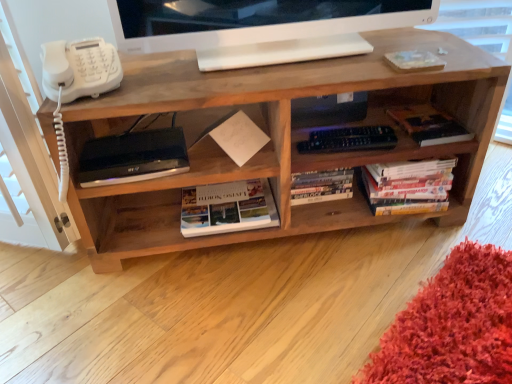
Question: Are satin black device at lower left and white plastic phone at left far apart?

Choices:
 (A) no
 (B) yes

Answer: (A)

Question: From a real-world perspective, does satin black device at lower left sit lower than white plastic phone at left?

Choices:
 (A) yes
 (B) no

Answer: (A)

Question: Is satin black device at lower left positioned in front of white plastic phone at left?

Choices:
 (A) no
 (B) yes

Answer: (A)

Question: From the image's perspective, is satin black device at lower left under white plastic phone at left?

Choices:
 (A) no
 (B) yes

Answer: (B)

Question: Is satin black device at lower left wider than white plastic phone at left?

Choices:
 (A) no
 (B) yes

Answer: (A)

Question: Considering their positions, is natural wood shelf at center located in front of or behind hardcover books at right, the second book positioned from the right?

Choices:
 (A) behind
 (B) front

Answer: (B)

Question: Visually, is natural wood shelf at center positioned to the left or to the right of hardcover books at right, the second book positioned from the right?

Choices:
 (A) right
 (B) left

Answer: (B)

Question: Is natural wood shelf at center wider or thinner than hardcover books at right, the second book positioned from the right?

Choices:
 (A) wide
 (B) thin

Answer: (A)

Question: Is point (463, 206) positioned closer to the camera than point (403, 167)?

Choices:
 (A) farther
 (B) closer

Answer: (A)

Question: Considering the positions of point (62, 76) and point (398, 109), is point (62, 76) closer or farther from the camera than point (398, 109)?

Choices:
 (A) closer
 (B) farther

Answer: (A)

Question: From a real-world perspective, is white plastic phone at left physically located above or below hardcover book at center-right, the first book in the right-to-left sequence?

Choices:
 (A) above
 (B) below

Answer: (A)

Question: Is white plastic phone at left in front of or behind hardcover book at center-right, which is counted as the 3th book, starting from the left, in the image?

Choices:
 (A) front
 (B) behind

Answer: (A)

Question: From the image's perspective, relative to hardcover book at center-right, the first book in the right-to-left sequence, is white plastic phone at left above or below?

Choices:
 (A) above
 (B) below

Answer: (A)

Question: From a real-world perspective, is white glossy monitor at upper center above or below satin black device at lower left?

Choices:
 (A) below
 (B) above

Answer: (B)

Question: From the image's perspective, is white glossy monitor at upper center above or below satin black device at lower left?

Choices:
 (A) above
 (B) below

Answer: (A)